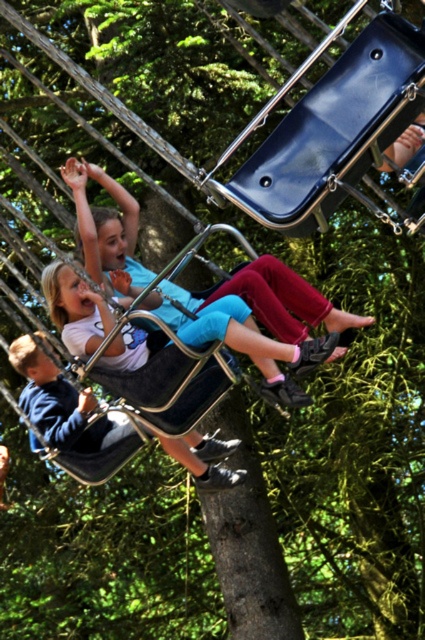
Question: Which point is farther from the camera taking this photo?

Choices:
 (A) (294, 320)
 (B) (90, 449)
 (C) (13, 358)

Answer: (B)

Question: Which is farther from the matte blue pants at center?

Choices:
 (A) matte black swing at lower left
 (B) blue denim jeans at lower left

Answer: (A)

Question: Can you confirm if matte blue pants at center is thinner than blue denim jeans at lower left?

Choices:
 (A) yes
 (B) no

Answer: (A)

Question: Which is nearer to the matte blue pants at center?

Choices:
 (A) blue denim jeans at lower left
 (B) matte black swing at lower left

Answer: (A)

Question: Does matte black swing at lower left appear over blue denim jeans at lower left?

Choices:
 (A) no
 (B) yes

Answer: (A)

Question: Can you confirm if matte black swing at lower left is positioned below blue denim jeans at lower left?

Choices:
 (A) no
 (B) yes

Answer: (B)